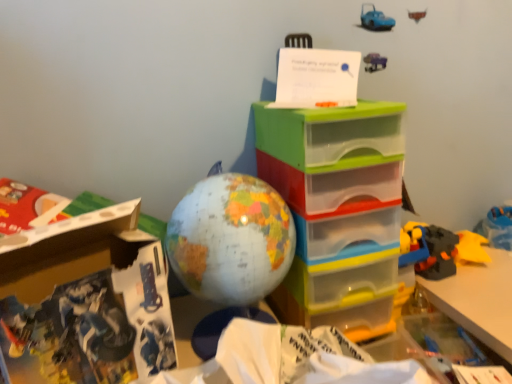
Question: Can we say translucent plastic drawers at center lies outside map-patterned globe at center?

Choices:
 (A) no
 (B) yes

Answer: (B)

Question: Can you confirm if translucent plastic drawers at center is wider than map-patterned globe at center?

Choices:
 (A) no
 (B) yes

Answer: (B)

Question: Does translucent plastic drawers at center have a smaller size compared to map-patterned globe at center?

Choices:
 (A) no
 (B) yes

Answer: (A)

Question: Considering the relative positions of translucent plastic drawers at center and map-patterned globe at center in the image provided, is translucent plastic drawers at center to the right of map-patterned globe at center from the viewer's perspective?

Choices:
 (A) yes
 (B) no

Answer: (A)

Question: Is map-patterned globe at center a part of translucent plastic drawers at center?

Choices:
 (A) no
 (B) yes

Answer: (A)

Question: Is point (123, 337) positioned closer to the camera than point (256, 112)?

Choices:
 (A) farther
 (B) closer

Answer: (B)

Question: From their relative heights in the image, would you say white cardboard box at lower left is taller or shorter than translucent plastic drawers at center?

Choices:
 (A) short
 (B) tall

Answer: (A)

Question: Considering the positions of white cardboard box at lower left and translucent plastic drawers at center in the image, is white cardboard box at lower left wider or thinner than translucent plastic drawers at center?

Choices:
 (A) wide
 (B) thin

Answer: (B)

Question: Considering the positions of white cardboard box at lower left and translucent plastic drawers at center in the image, is white cardboard box at lower left bigger or smaller than translucent plastic drawers at center?

Choices:
 (A) big
 (B) small

Answer: (B)

Question: Is point (265, 221) positioned closer to the camera than point (126, 206)?

Choices:
 (A) farther
 (B) closer

Answer: (A)

Question: From the image's perspective, is map-patterned globe at center above or below white cardboard box at lower left?

Choices:
 (A) above
 (B) below

Answer: (A)

Question: Would you say map-patterned globe at center is inside or outside white cardboard box at lower left?

Choices:
 (A) inside
 (B) outside

Answer: (B)

Question: In the image, is map-patterned globe at center positioned in front of or behind white cardboard box at lower left?

Choices:
 (A) behind
 (B) front

Answer: (A)

Question: Considering the positions of translucent plastic drawers at center and white cardboard box at lower left in the image, is translucent plastic drawers at center wider or thinner than white cardboard box at lower left?

Choices:
 (A) wide
 (B) thin

Answer: (A)

Question: From the image's perspective, relative to white cardboard box at lower left, is translucent plastic drawers at center above or below?

Choices:
 (A) below
 (B) above

Answer: (B)